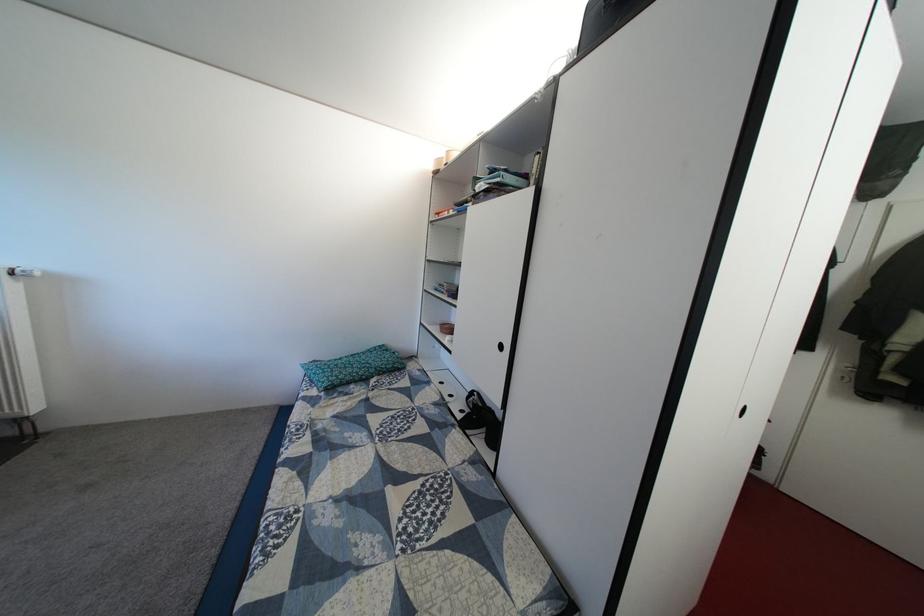
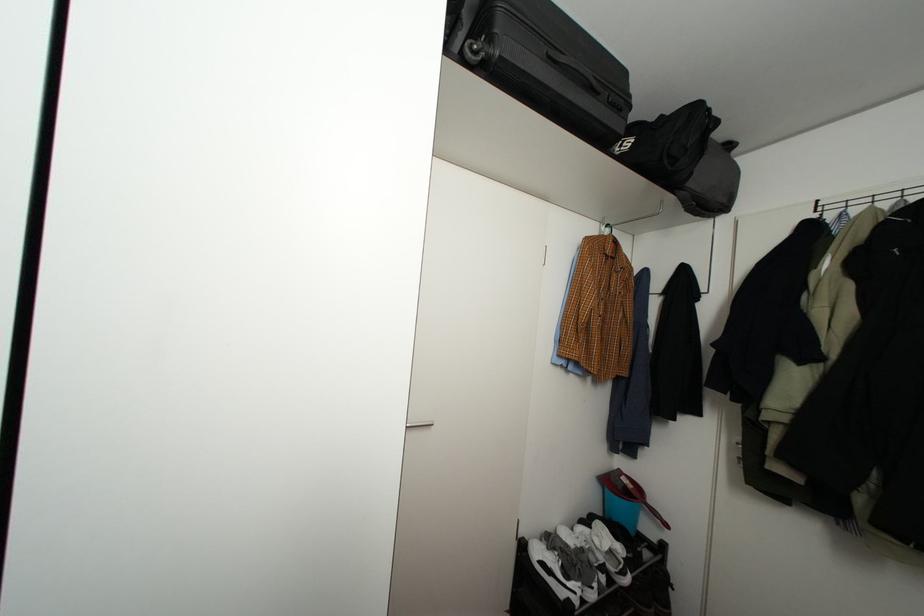
Question: The images are taken continuously from a first-person perspective. In which direction are you moving?

Choices:
 (A) Left
 (B) Right
 (C) Forward
 (D) Backward

Answer: (B)